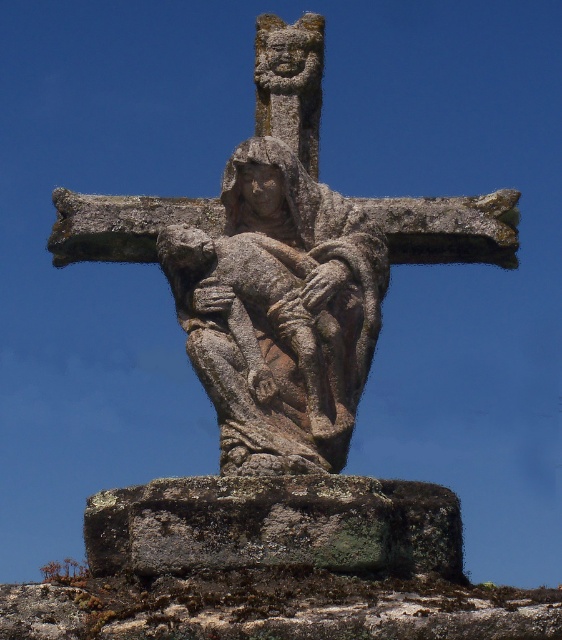
You are standing in front of a stone sculpture of the Virgin Mary holding the infant Jesus positioned at the center of a cross. The sculpture is weathered with erosion and moss growth. There is a point marked at coordinates (x=283, y=266). Can you determine if the rough stone sculpture at center is located at that point?

The rough stone sculpture at center is located at point (x=283, y=266), so yes, the sculpture is at that point.